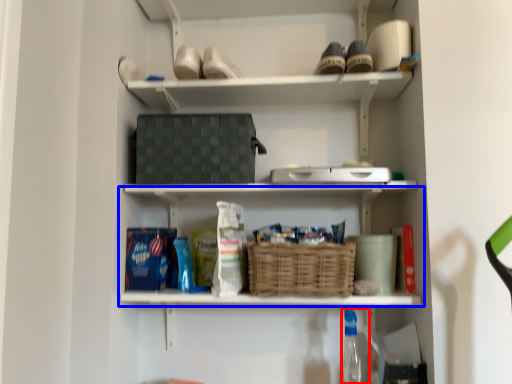
Question: Among these objects, which one is farthest to the camera, bottle (highlighted by a red box) or shelf (highlighted by a blue box)?

Choices:
 (A) bottle
 (B) shelf

Answer: (B)